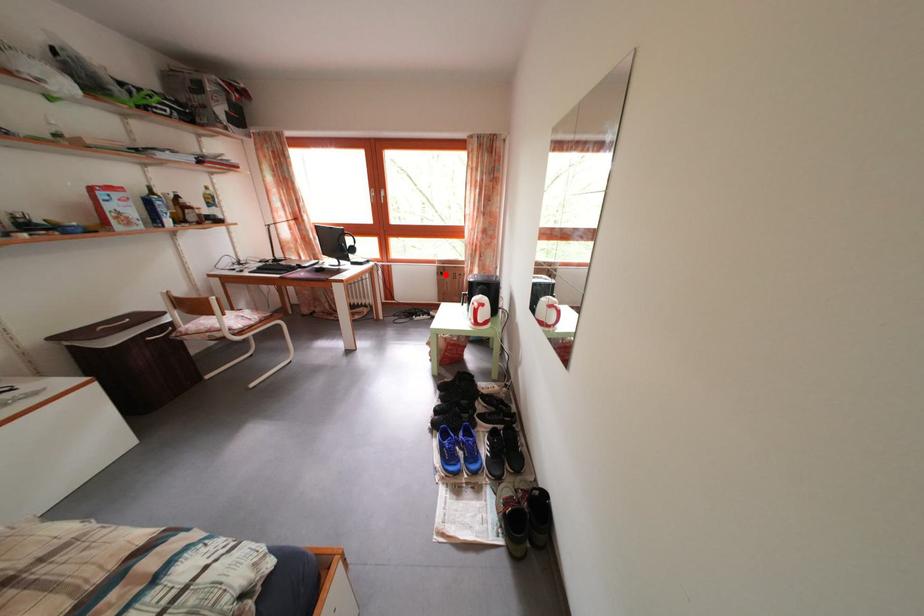
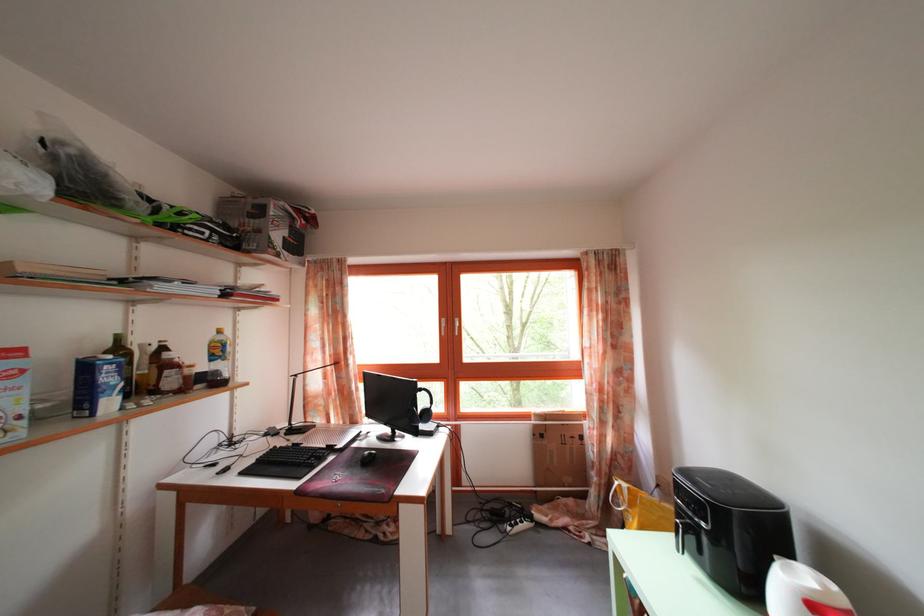
Question: A red point is marked in image1. In image2, is the corresponding 3D point closer to the camera or farther? Reply with the corresponding letter.

Choices:
 (A) The corresponding 3D point is closer.
 (B) The corresponding 3D point is farther.

Answer: (B)